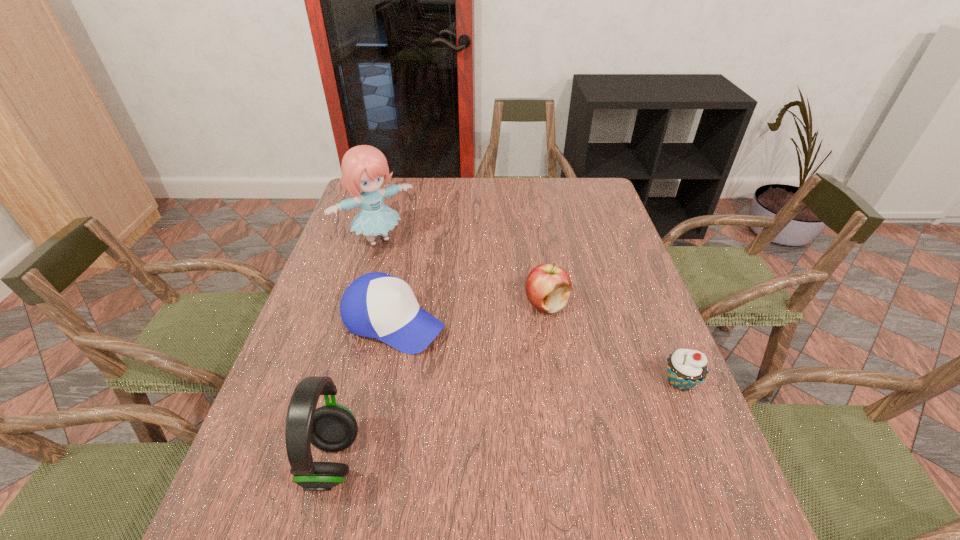
At what (x,y) coordinates should I click in order to perform the action: click on object that stands as the second closest to the baseball cap. Please return your answer as a coordinate pair (x, y). The image size is (960, 540). Looking at the image, I should click on (331, 428).

What are the coordinates of `object that is the third closest one to the rightmost object` in the screenshot? It's located at [x=331, y=428].

Identify the location of vacant point that satisfies the following two spatial constraints: 1. on the front side of the farthest object; 2. on the ear cups of the headset. (312, 462).

Identify the location of free space that satisfies the following two spatial constraints: 1. on the front side of the farthest object; 2. on the ear cups of the second tallest object. The image size is (960, 540). (312, 462).